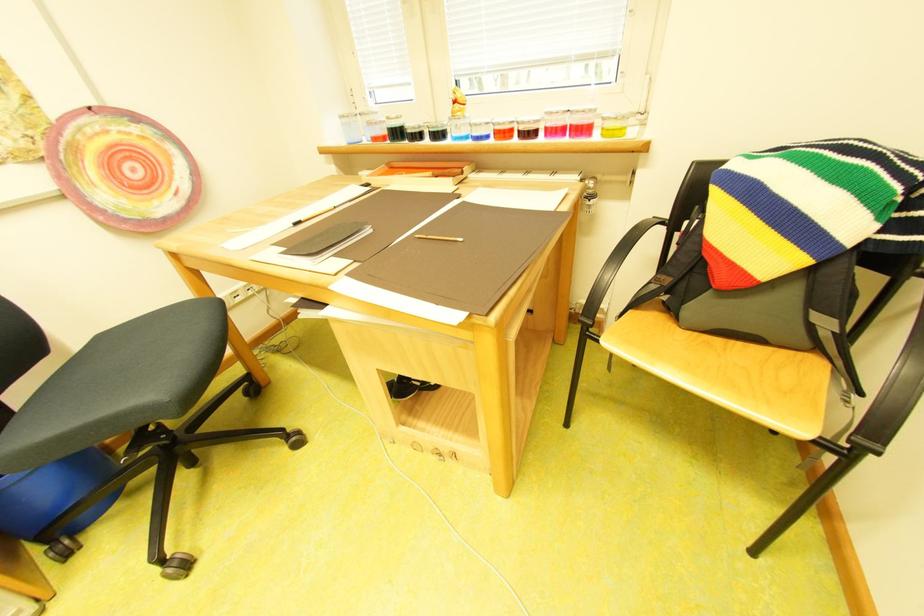
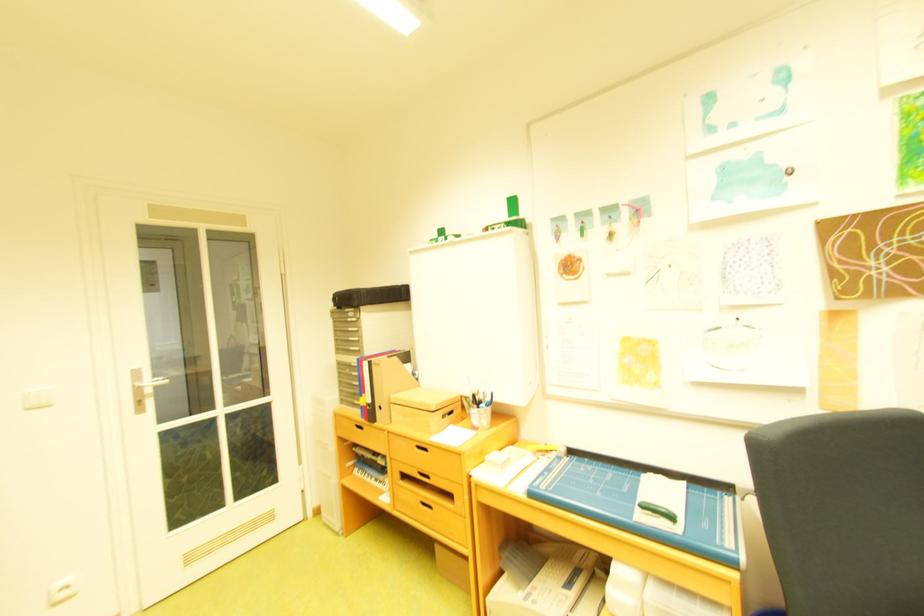
Question: The camera is either moving clockwise (left) or counter-clockwise (right) around the object. The first image is from the beginning of the video and the second image is from the end. Is the camera moving left or right when shooting the video?

Choices:
 (A) Left
 (B) Right

Answer: (B)